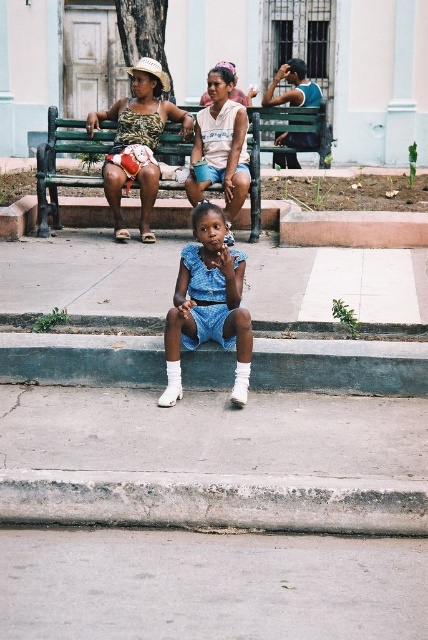
You are a street artist planning to paint a mural on the gray concrete curb at lower center and the matte blue dress at center. Since you want to ensure the murals are proportional, which object should you make the larger mural on?

The gray concrete curb at lower center has a larger width than the matte blue dress at center, so you should make the larger mural on the gray concrete curb at lower center to match its size.

You are a photographer trying to capture a shot of the matte blue dress at center and the brown concrete curb at lower center. Based on their positions, which object should you adjust your camera to focus on first if you want to ensure both are in frame without moving the camera?

The matte blue dress at center is to the left of the brown concrete curb at lower center, so you should focus on the brown concrete curb at lower center first to ensure both are in frame without moving the camera.